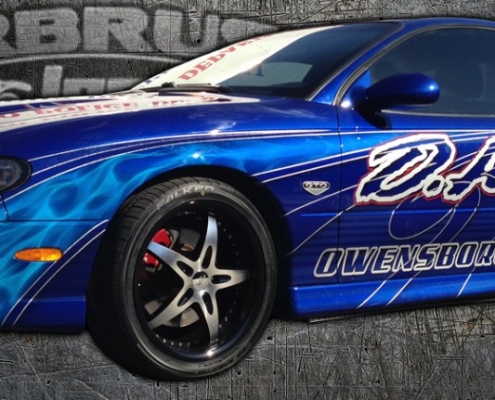
Where is `light`? The width and height of the screenshot is (495, 400). light is located at coordinates (14, 175).